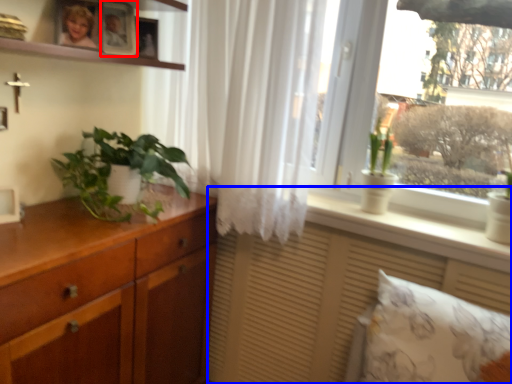
Question: Which object is closer to the camera taking this photo, picture frame (highlighted by a red box) or vanity (highlighted by a blue box)?

Choices:
 (A) picture frame
 (B) vanity

Answer: (B)